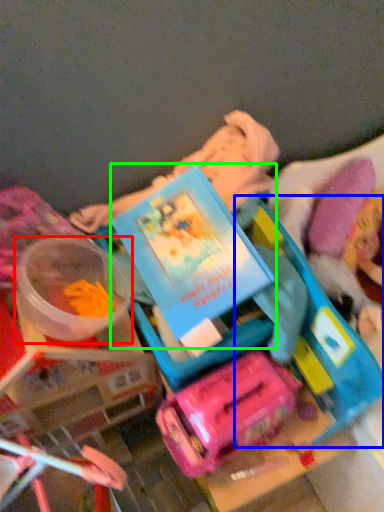
Question: Which object is positioned farthest from toy (highlighted by a red box)? Select from toy (highlighted by a blue box) and book (highlighted by a green box).

Choices:
 (A) toy
 (B) book

Answer: (A)